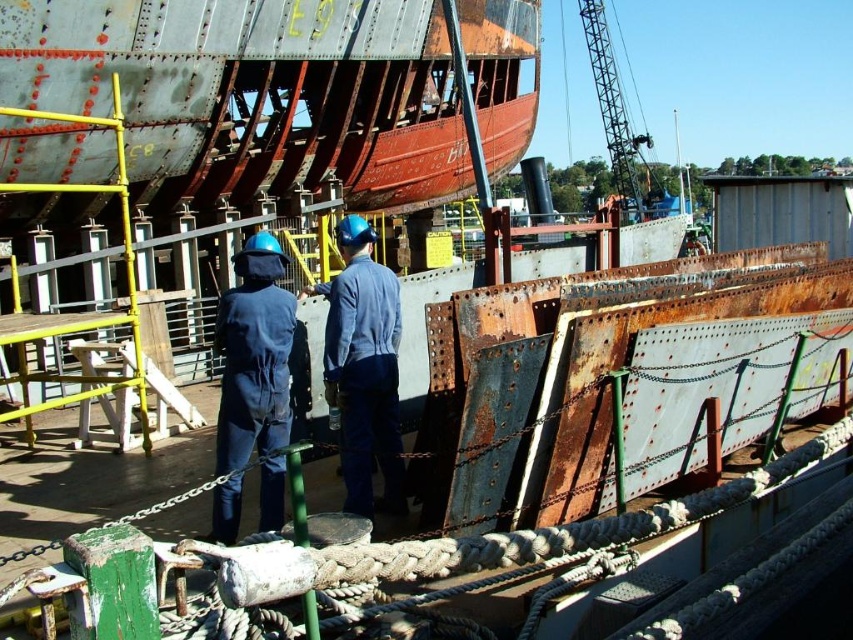
Question: Is blue fabric jumpsuit at center closer to camera compared to blue denim shirt at center?

Choices:
 (A) yes
 (B) no

Answer: (A)

Question: Estimate the real-world distances between objects in this image. Which object is closer to the brushed metal crane at upper center?

Choices:
 (A) blue denim shirt at center
 (B) blue fabric jumpsuit at center

Answer: (B)

Question: Can you confirm if blue denim shirt at center is positioned above brushed metal crane at upper center?

Choices:
 (A) no
 (B) yes

Answer: (A)

Question: Which point is farther from the camera taking this photo?

Choices:
 (A) (601, 3)
 (B) (268, 516)
 (C) (366, 497)

Answer: (A)

Question: Which point appears closest to the camera in this image?

Choices:
 (A) (593, 19)
 (B) (376, 300)

Answer: (B)

Question: Does blue fabric jumpsuit at center appear on the right side of brushed metal crane at upper center?

Choices:
 (A) yes
 (B) no

Answer: (B)